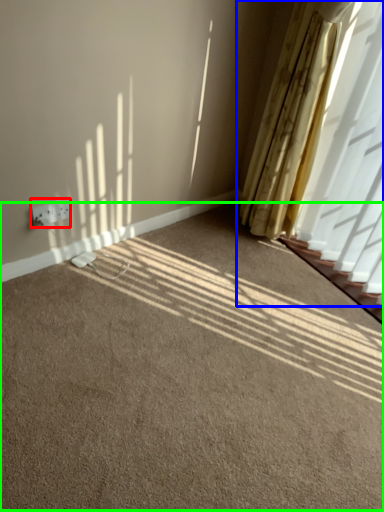
Question: Estimate the real-world distances between objects in this image. Which object is farther from electric outlet (highlighted by a red box), curtain (highlighted by a blue box) or plain (highlighted by a green box)?

Choices:
 (A) curtain
 (B) plain

Answer: (A)